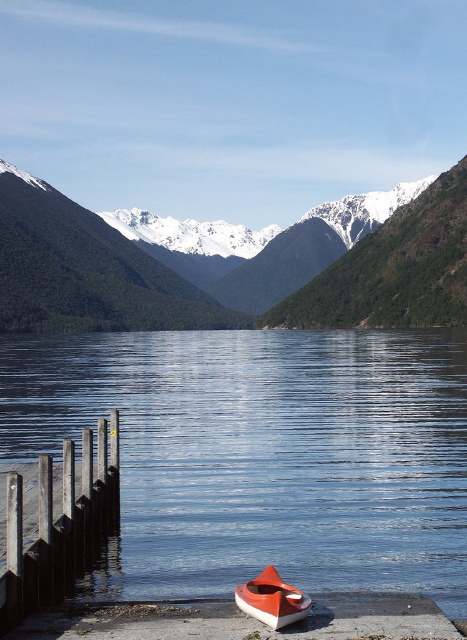
Question: Is smooth blue water at center thinner than green matte mountain at center?

Choices:
 (A) no
 (B) yes

Answer: (B)

Question: Which object is farther from the camera taking this photo?

Choices:
 (A) smooth blue water at center
 (B) dark gray wooden posts at lower left

Answer: (A)

Question: Which is nearer to the green matte mountain at center?

Choices:
 (A) orange matte boat at lower center
 (B) dark gray wooden posts at lower left

Answer: (B)

Question: Is dark gray wooden posts at lower left bigger than orange matte boat at lower center?

Choices:
 (A) yes
 (B) no

Answer: (A)

Question: Which object is farther from the camera taking this photo?

Choices:
 (A) green matte mountain at center
 (B) dark gray wooden posts at lower left

Answer: (A)

Question: Is dark gray wooden posts at lower left above orange matte boat at lower center?

Choices:
 (A) yes
 (B) no

Answer: (A)